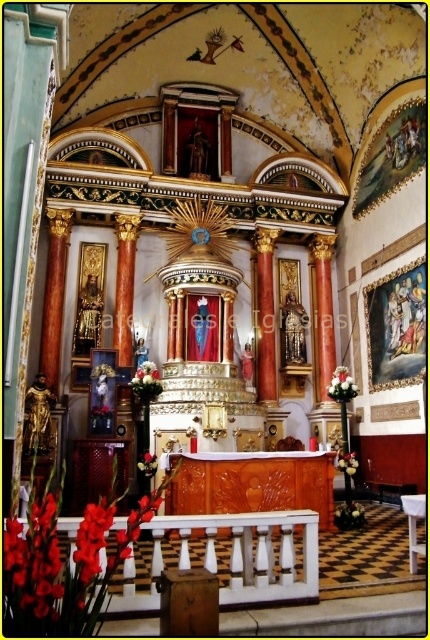
Measure the distance from white silk flowers at right to white matte flower at lower center.

A distance of 7.10 meters exists between white silk flowers at right and white matte flower at lower center.

Describe the element at coordinates (341, 385) in the screenshot. The image size is (430, 640). I see `white silk flowers at right` at that location.

Between point (332, 378) and point (350, 472), which one is positioned behind?

The point (332, 378) is more distant.

The height and width of the screenshot is (640, 430). I want to click on white silk flowers at right, so click(341, 385).

Can you confirm if white silk flowers at right is positioned above white matte vase at center?

Yes.

From the picture: Can you confirm if white silk flowers at right is thinner than white matte vase at center?

No, white silk flowers at right is not thinner than white matte vase at center.

Who is more forward, (355, 390) or (147, 464)?

Point (147, 464) is more forward.

Locate an element on the screen. Image resolution: width=430 pixels, height=640 pixels. white silk flowers at right is located at coordinates (341, 385).

Who is higher up, white matte flower at lower center or white matte vase at center?

white matte vase at center is higher up.

Can you confirm if white matte flower at lower center is positioned to the right of white matte vase at center?

Yes, white matte flower at lower center is to the right of white matte vase at center.

At what (x,y) coordinates should I click in order to perform the action: click on white matte flower at lower center. Please return your answer as a coordinate pair (x, y). Looking at the image, I should click on pos(347,461).